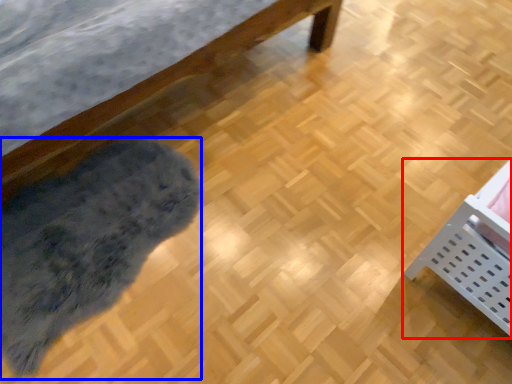
Question: Which point is further to the camera, furniture (highlighted by a red box) or mat (highlighted by a blue box)?

Choices:
 (A) furniture
 (B) mat

Answer: (B)